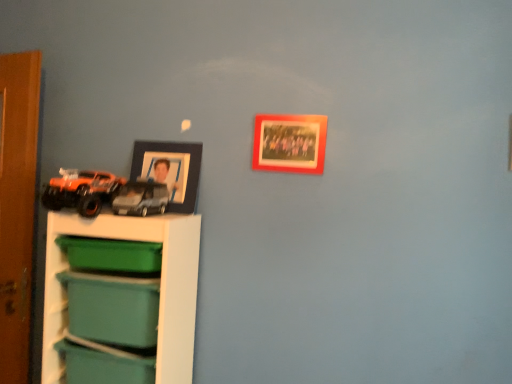
Question: Considering the positions of orange matte truck at left, arranged as the 2th toy when viewed from the right, and green plastic storage box at lower left, the first storage box when ordered from top to bottom, in the image, is orange matte truck at left, arranged as the 2th toy when viewed from the right, taller or shorter than green plastic storage box at lower left, the first storage box when ordered from top to bottom,?

Choices:
 (A) short
 (B) tall

Answer: (B)

Question: Would you say orange matte truck at left, arranged as the 2th toy when viewed from the right, is to the left or to the right of green plastic storage box at lower left, the first storage box when ordered from top to bottom, in the picture?

Choices:
 (A) right
 (B) left

Answer: (B)

Question: Which object is the closest to the black matte picture frame at upper left, the 1th picture frame viewed from the left?

Choices:
 (A) matte black car at left, which is the second toy in left-to-right order
 (B) orange matte truck at left, which is counted as the first toy, starting from the left
 (C) white plastic shelf at lower left
 (D) wooden photo frame at upper center, the 2th picture frame from the back
 (E) matte green plastic storage box at lower left, the 2th storage box positioned from the top

Answer: (A)

Question: Estimate the real-world distances between objects in this image. Which object is farther from the matte black car at left, which is the second toy in left-to-right order?

Choices:
 (A) matte green plastic storage box at lower left, the 2th storage box positioned from the top
 (B) green plastic storage box at lower left, the 3th storage box ordered from the bottom
 (C) white plastic shelf at lower left
 (D) teal plastic storage box at lower left, the 1th storage box ordered from the bottom
 (E) black matte picture frame at upper left, the 1th picture frame viewed from the left

Answer: (D)